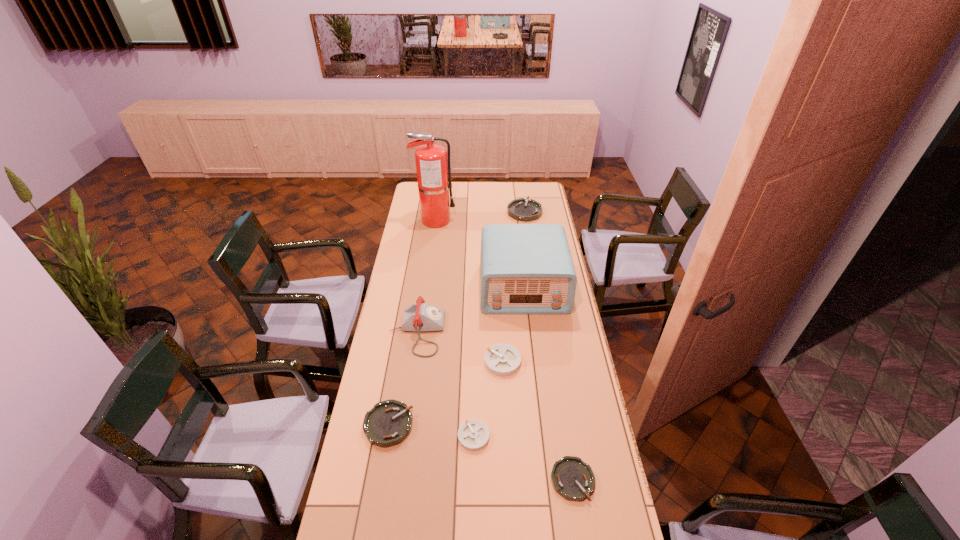
Locate an element on the screen. fire extinguisher is located at coordinates (433, 172).

Locate an element on the screen. This screenshot has width=960, height=540. red fire extinguisher is located at coordinates (433, 172).

Locate an element on the screen. This screenshot has width=960, height=540. radio receiver is located at coordinates (527, 269).

The height and width of the screenshot is (540, 960). Identify the location of the sixth shortest object. (419, 317).

Identify the location of telephone. Image resolution: width=960 pixels, height=540 pixels. (419, 317).

Identify the location of the biggest green ashtray. The width and height of the screenshot is (960, 540). (522, 209).

Locate an element on the screen. the farthest green ashtray is located at coordinates (522, 209).

Where is `the bigger gray ashtray`? Image resolution: width=960 pixels, height=540 pixels. the bigger gray ashtray is located at coordinates (501, 359).

At what (x,y) coordinates should I click in order to perform the action: click on the second farthest ashtray. Please return your answer as a coordinate pair (x, y). This screenshot has width=960, height=540. Looking at the image, I should click on (501, 359).

In order to click on the leftmost green ashtray in this screenshot , I will do `click(388, 423)`.